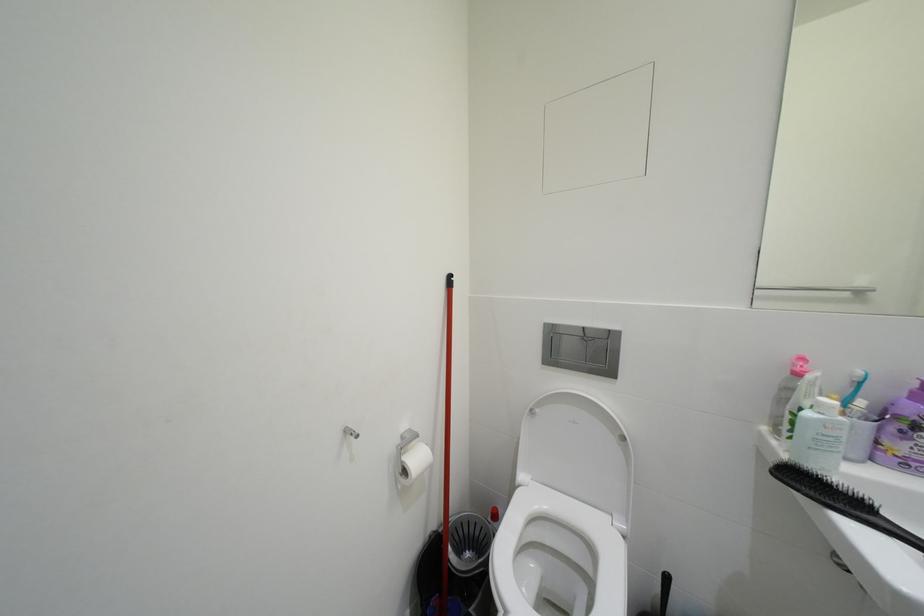
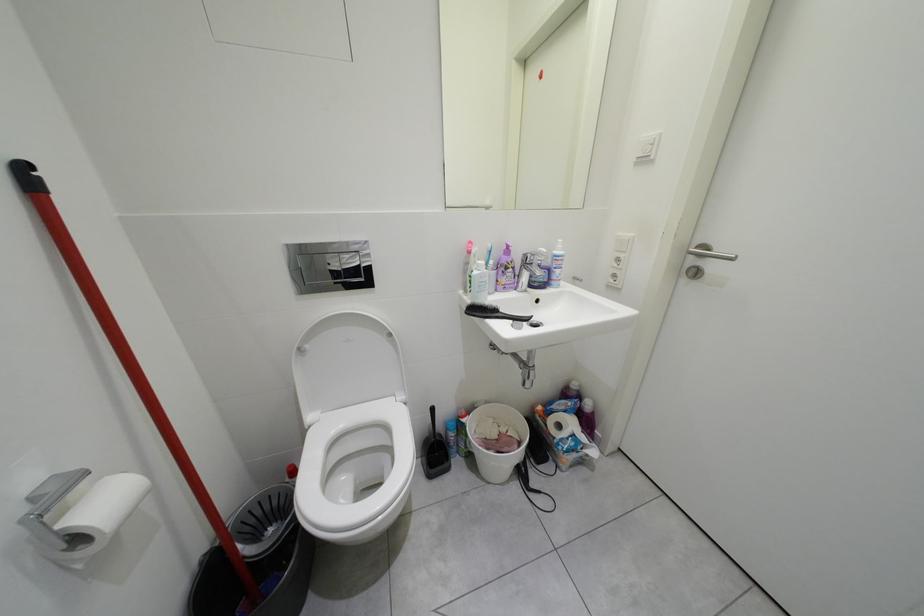
How did the camera likely rotate?

The rotation direction of the camera is right-down.